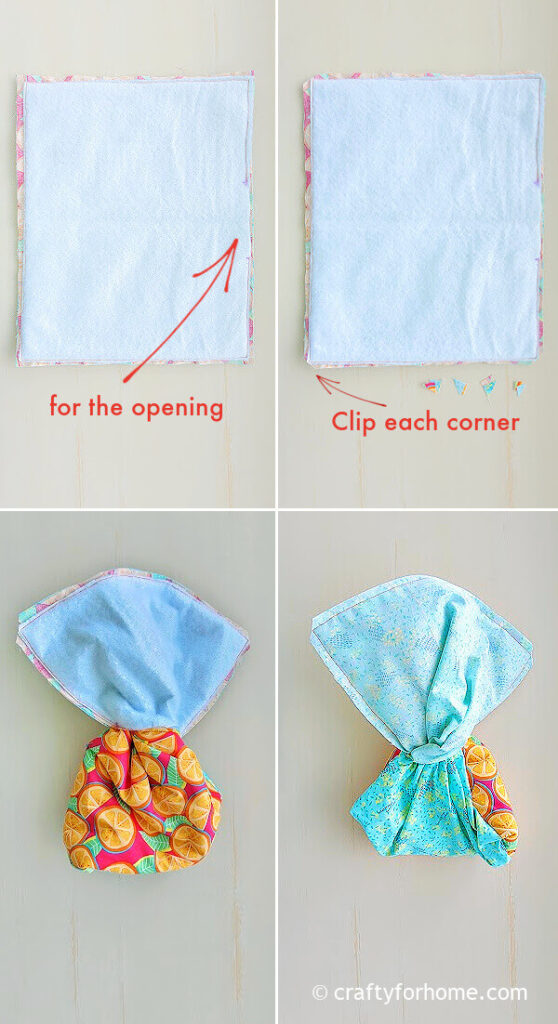
Identify the location of corner. This screenshot has height=1024, width=558. (468, 423).